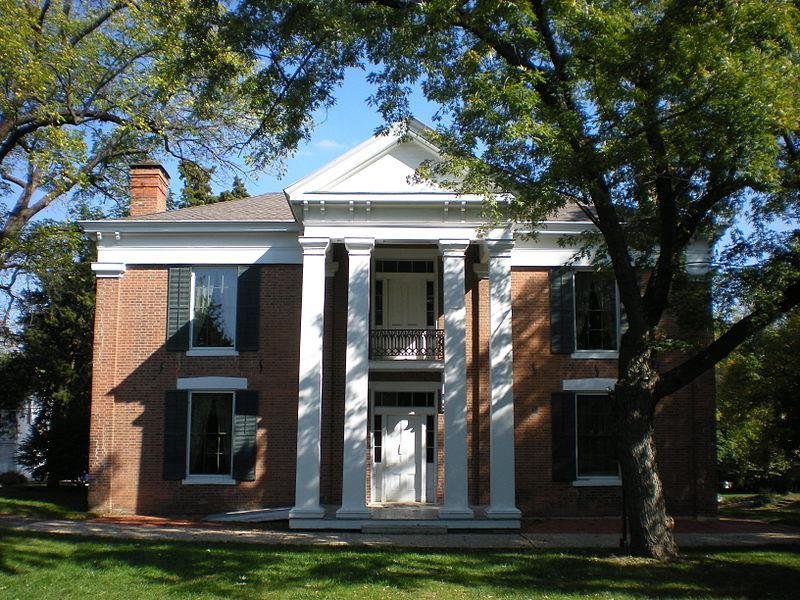
The width and height of the screenshot is (800, 600). Find the location of `brick wall`. brick wall is located at coordinates (136, 363).